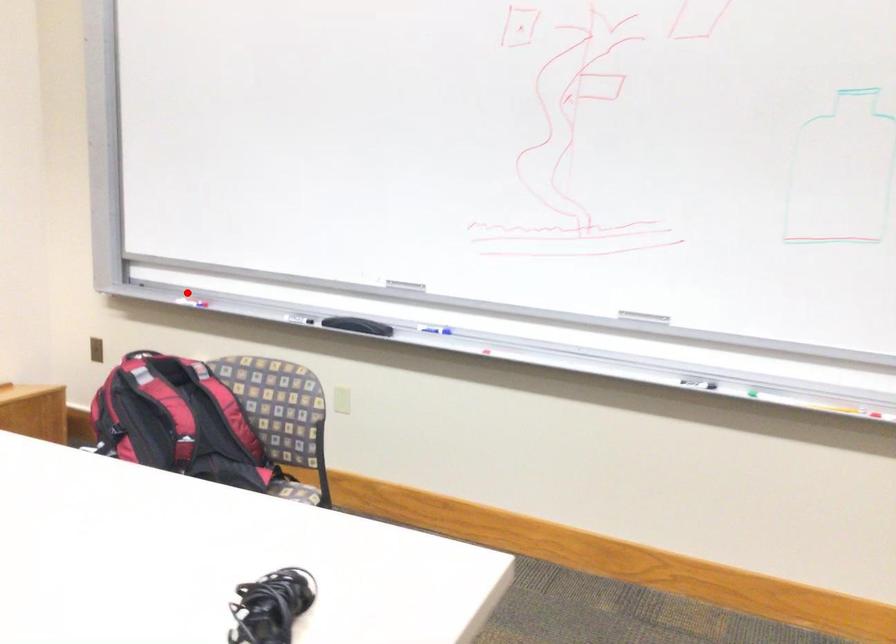
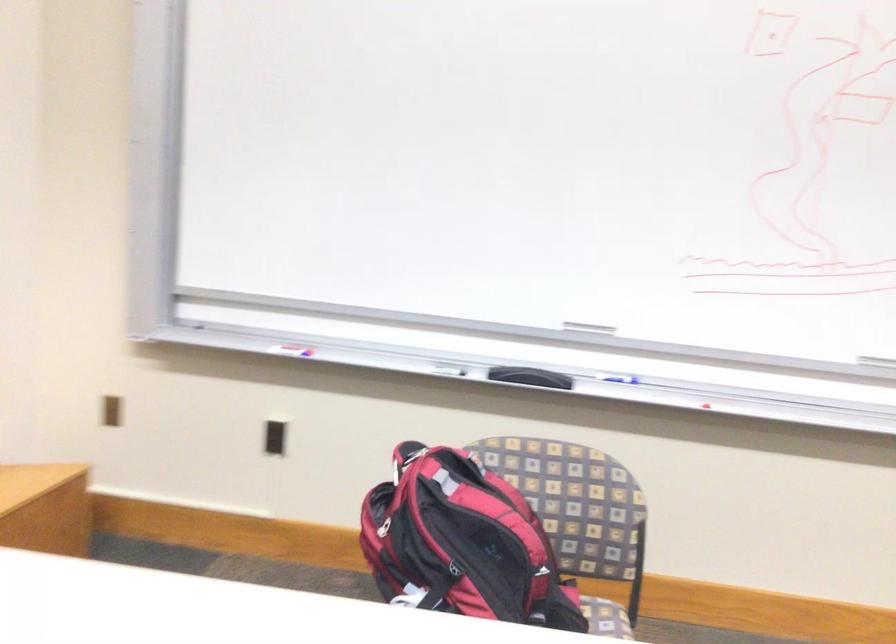
Question: I am providing you with two images of the same scene from different viewpoints. Image1 has a red point marked. In image2, the corresponding 3D location appears at what relative position? Reply with the corresponding letter.

Choices:
 (A) Closer
 (B) Farther

Answer: (A)